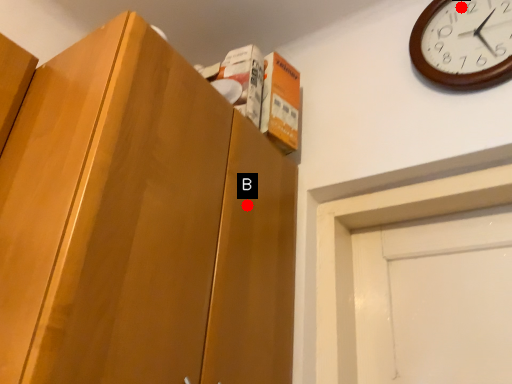
Question: Two points are circled on the image, labeled by A and B beside each circle. Which point is closer to the camera?

Choices:
 (A) A is closer
 (B) B is closer

Answer: (B)